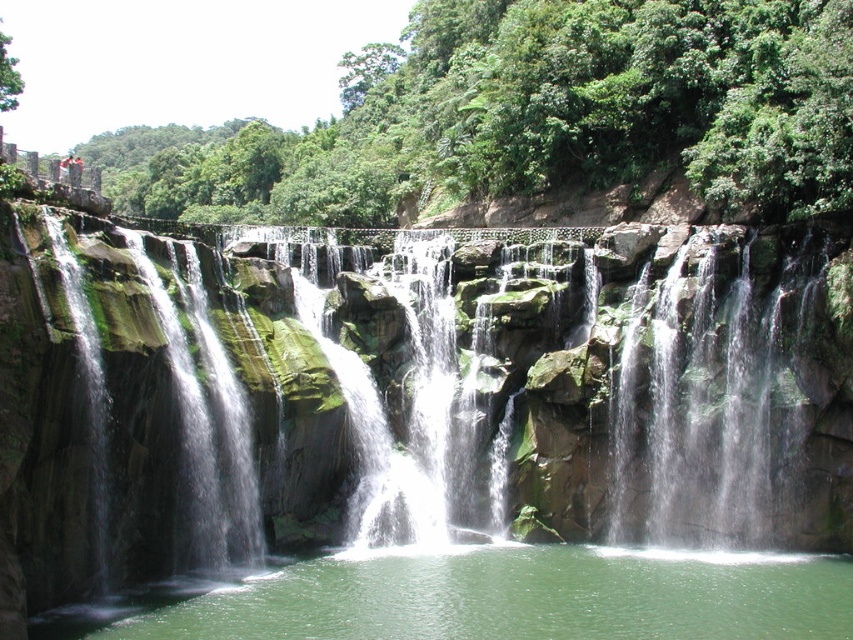
Question: Which point appears farthest from the camera in this image?

Choices:
 (A) (142, 376)
 (B) (108, 625)

Answer: (A)

Question: Can you confirm if green mossy rocks at center is smaller than green liquid water at center?

Choices:
 (A) yes
 (B) no

Answer: (B)

Question: Is green mossy rocks at center behind green liquid water at center?

Choices:
 (A) no
 (B) yes

Answer: (A)

Question: Which point appears closest to the camera in this image?

Choices:
 (A) (61, 637)
 (B) (469, 260)

Answer: (A)

Question: Can you confirm if green mossy rocks at center is smaller than green liquid water at center?

Choices:
 (A) yes
 (B) no

Answer: (B)